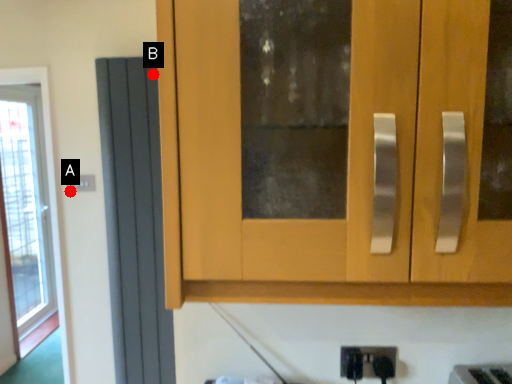
Question: Two points are circled on the image, labeled by A and B beside each circle. Which point is closer to the camera?

Choices:
 (A) A is closer
 (B) B is closer

Answer: (B)